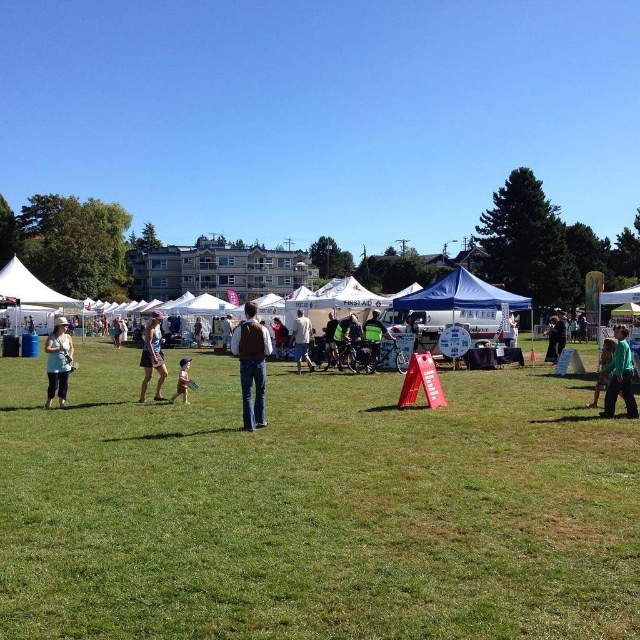
You are at the community fair and want to locate the first aid tent. You see a green matte shirt at right and a black fabric umbrella at center. Which object is closer to the first aid tent?

The green matte shirt at right is smaller than the black fabric umbrella at center, but this does not indicate proximity. The first aid tents are mentioned in the scene description as being in the background near the white tents. Neither object is directly associated with the first aid tents in the provided details, so their positions relative to the tents cannot be determined from the given information.